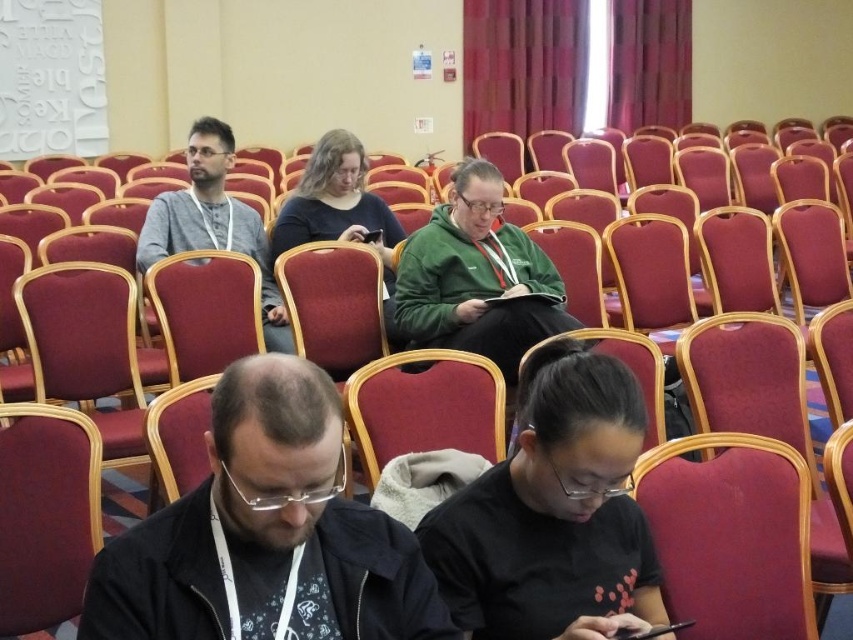
Is black matte jacket at lower center behind black matte shirt at lower center?

No, it is not.

Can you confirm if black matte jacket at lower center is positioned below black matte shirt at lower center?

Actually, black matte jacket at lower center is above black matte shirt at lower center.

In order to click on black matte jacket at lower center in this screenshot , I will do `click(267, 532)`.

Who is positioned more to the right, black matte jacket at lower center or gray knit sweater at left?

black matte jacket at lower center is more to the right.

Is black matte jacket at lower center taller than gray knit sweater at left?

Incorrect, black matte jacket at lower center's height is not larger of gray knit sweater at left's.

Who is more forward, (x=352, y=576) or (x=173, y=227)?

Positioned in front is point (x=352, y=576).

Locate an element on the screen. The image size is (853, 640). black matte jacket at lower center is located at coordinates (267, 532).

Based on the photo, between black matte shirt at lower center and gray knit sweater at left, which one appears on the right side from the viewer's perspective?

black matte shirt at lower center is more to the right.

Is black matte shirt at lower center shorter than gray knit sweater at left?

Yes, black matte shirt at lower center is shorter than gray knit sweater at left.

The width and height of the screenshot is (853, 640). I want to click on black matte shirt at lower center, so click(x=553, y=513).